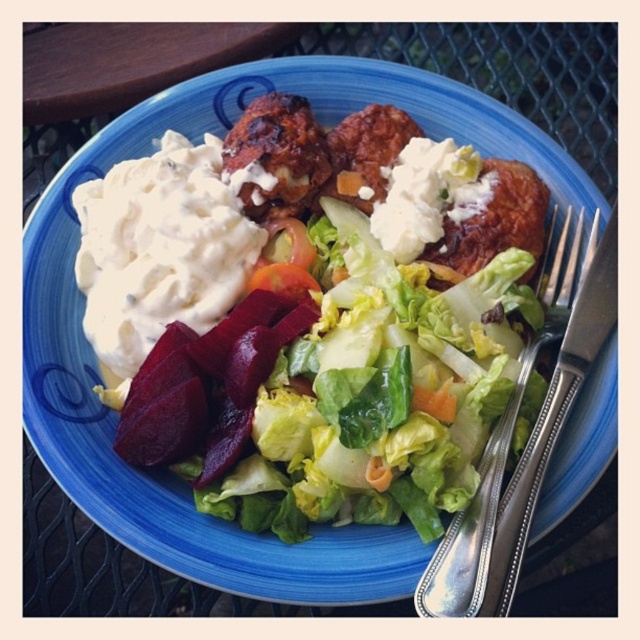
You are a food critic who needs to describe the arrangement of the meal on the plate. Which object is positioned above the other between the matte green lettuce at center and the brown crispy meatballs at upper center?

The brown crispy meatballs at upper center are positioned above the matte green lettuce at center.